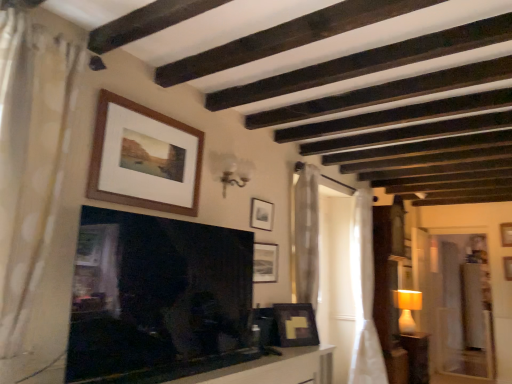
Question: Which direction should I rotate to look at wooden picture frame at upper center, positioned as the first picture frame in right-to-left order, — up or down?

Choices:
 (A) up
 (B) down

Answer: (B)

Question: Are white sheer curtain at right, the 1th curtain viewed from the back, and matte black picture frame at upper center, marked as the 3th picture frame in a left-to-right arrangement, far apart?

Choices:
 (A) yes
 (B) no

Answer: (A)

Question: From a real-world perspective, is white sheer curtain at right, the 1th curtain viewed from the back, on top of matte black picture frame at upper center, acting as the fourth picture frame starting from the bottom?

Choices:
 (A) no
 (B) yes

Answer: (A)

Question: Is the position of white sheer curtain at right, the 1th curtain viewed from the back, less distant than that of matte black picture frame at upper center, which is the third picture frame from right to left?

Choices:
 (A) no
 (B) yes

Answer: (A)

Question: Is white sheer curtain at right, which ranks as the 1th curtain in right-to-left order, wider than matte black picture frame at upper center, which is the third picture frame from right to left?

Choices:
 (A) yes
 (B) no

Answer: (A)

Question: Is white sheer curtain at right, the 3th curtain positioned from the front, positioned behind matte black picture frame at upper center, acting as the fourth picture frame starting from the bottom?

Choices:
 (A) yes
 (B) no

Answer: (A)

Question: Is white sheer curtain at right, which ranks as the 1th curtain in right-to-left order, smaller than matte black picture frame at upper center, marked as the 3th picture frame in a left-to-right arrangement?

Choices:
 (A) yes
 (B) no

Answer: (B)

Question: Does matte black picture frame at lower right, marked as the second picture frame in a right-to-left arrangement, have a larger size compared to matte black picture frame at upper center, which is the 2th picture frame in top-to-bottom order?

Choices:
 (A) yes
 (B) no

Answer: (A)

Question: Can you see matte black picture frame at lower right, which appears as the 3th picture frame when viewed from the front, touching matte black picture frame at upper center, which is the 2th picture frame in top-to-bottom order?

Choices:
 (A) no
 (B) yes

Answer: (A)

Question: Considering the relative sizes of matte black picture frame at lower right, marked as the second picture frame in a right-to-left arrangement, and matte black picture frame at upper center, acting as the fourth picture frame starting from the bottom, in the image provided, is matte black picture frame at lower right, marked as the second picture frame in a right-to-left arrangement, taller than matte black picture frame at upper center, acting as the fourth picture frame starting from the bottom,?

Choices:
 (A) yes
 (B) no

Answer: (A)

Question: Is matte black picture frame at lower right, placed as the first picture frame when sorted from bottom to top, looking in the opposite direction of matte black picture frame at upper center, acting as the fourth picture frame starting from the bottom?

Choices:
 (A) yes
 (B) no

Answer: (B)

Question: Considering the relative positions of matte black picture frame at lower right, arranged as the fifth picture frame when viewed from the top, and matte black picture frame at upper center, which is counted as the 4th picture frame, starting from the front, in the image provided, is matte black picture frame at lower right, arranged as the fifth picture frame when viewed from the top, to the left of matte black picture frame at upper center, which is counted as the 4th picture frame, starting from the front, from the viewer's perspective?

Choices:
 (A) yes
 (B) no

Answer: (B)

Question: Is matte black picture frame at lower right, arranged as the fifth picture frame when viewed from the top, shorter than matte black picture frame at upper center, which is the 2th picture frame in top-to-bottom order?

Choices:
 (A) no
 (B) yes

Answer: (A)

Question: Can you confirm if white dotted fabric curtain at left, the 3th curtain in the right-to-left sequence, is taller than smooth white table at lower center?

Choices:
 (A) no
 (B) yes

Answer: (B)